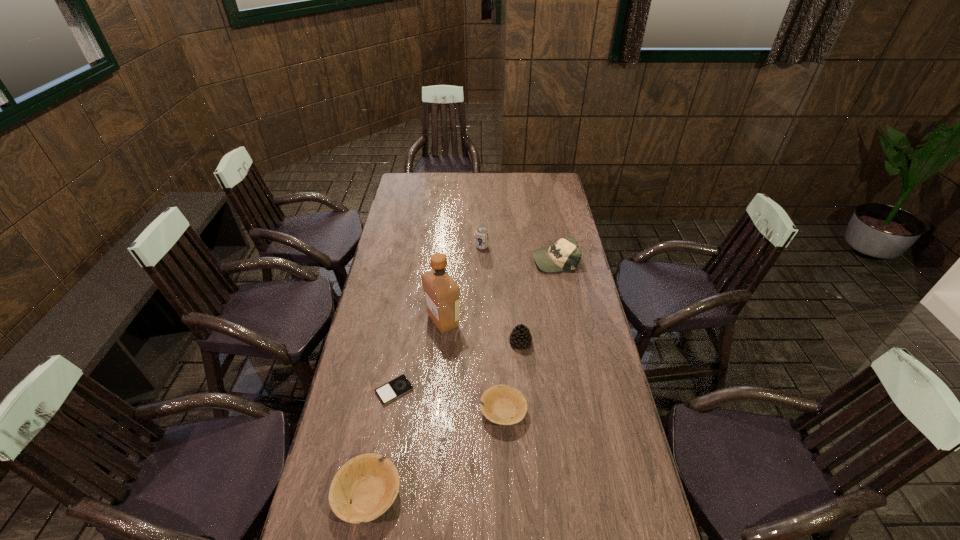
What are the coordinates of `free space located on the right of the taller bowl` in the screenshot? It's located at (451, 495).

Locate an element on the screen. free point located on the right of the right bowl is located at coordinates click(566, 411).

The height and width of the screenshot is (540, 960). Identify the location of vacant space positioned on the back of the beer can. (482, 220).

This screenshot has height=540, width=960. In order to click on vacant region located 0.370m on the front-facing side of the liquor in this screenshot , I will do `click(557, 321)`.

Find the location of a particular element. The height and width of the screenshot is (540, 960). free region located on the front-facing side of the rightmost object is located at coordinates (479, 260).

Find the location of `blank area located 0.120m on the front-facing side of the rightmost object`. blank area located 0.120m on the front-facing side of the rightmost object is located at coordinates (506, 260).

Locate an element on the screen. This screenshot has width=960, height=540. vacant space situated 0.200m on the front-facing side of the rightmost object is located at coordinates (488, 260).

At what (x,y) coordinates should I click in order to perform the action: click on vacant space located 0.070m on the back of the shortest object. Please return your answer as a coordinate pair (x, y). The height and width of the screenshot is (540, 960). Looking at the image, I should click on coord(399,360).

The height and width of the screenshot is (540, 960). What are the coordinates of `blank area located 0.210m at the narrow end of the pinecone` in the screenshot? It's located at (525, 402).

Where is `object that is at the near edge`? The width and height of the screenshot is (960, 540). object that is at the near edge is located at coordinates [370, 482].